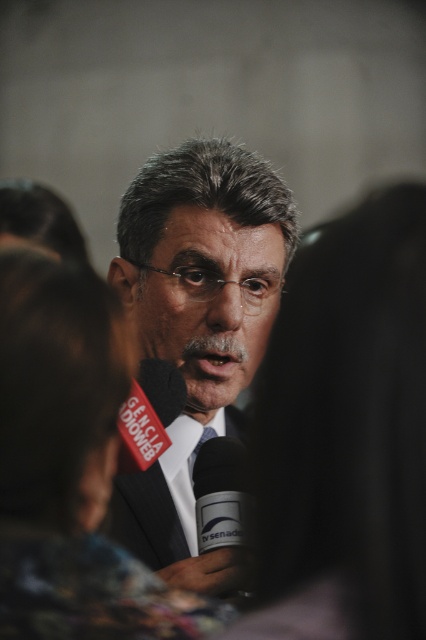
Which is below, matte black suit at center or black matte microphone at center?

black matte microphone at center

Where is `matte black suit at center`? matte black suit at center is located at coordinates pyautogui.click(x=195, y=330).

The image size is (426, 640). In order to click on matte black suit at center in this screenshot , I will do `click(195, 330)`.

Can you confirm if black matte suit at lower center is positioned below blue silk tie at center?

Indeed, black matte suit at lower center is positioned under blue silk tie at center.

Is black matte suit at lower center above blue silk tie at center?

No.

Locate an element on the screen. The image size is (426, 640). black matte suit at lower center is located at coordinates (172, 538).

Between point (215, 468) and point (193, 449), which one is positioned in front?

Point (215, 468)

Is point (242, 483) less distant than point (193, 476)?

Yes, it is.

At what (x,y) coordinates should I click in order to perform the action: click on black matte microphone at center. Please return your answer as a coordinate pair (x, y). Image resolution: width=426 pixels, height=640 pixels. Looking at the image, I should click on (221, 496).